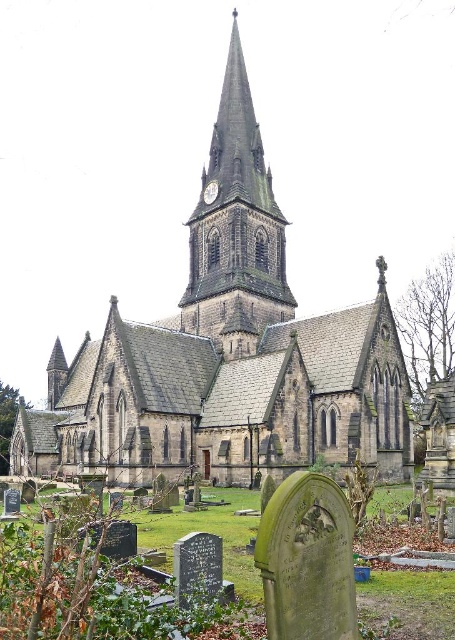
Based on the photo, you are standing in front of a Gothic church and want to take a photo of the dark gray stone clock tower at center. If your camera has a maximum zoom range of 100 meters, will you be able to capture the entire clock tower in the photo without moving closer?

The distance between you and the dark gray stone clock tower at center is 98.15 meters, which is within the camera maximum zoom range of 100 meters. Therefore, you can capture the entire clock tower in the photo without moving closer.

You are standing in front of the Gothic church and want to take a photo of the dark gray stone clock tower at center and the metallic clock at center. Which one is positioned higher in the image?

The dark gray stone clock tower at center is above the metallic clock at center, so it is positioned higher in the image.